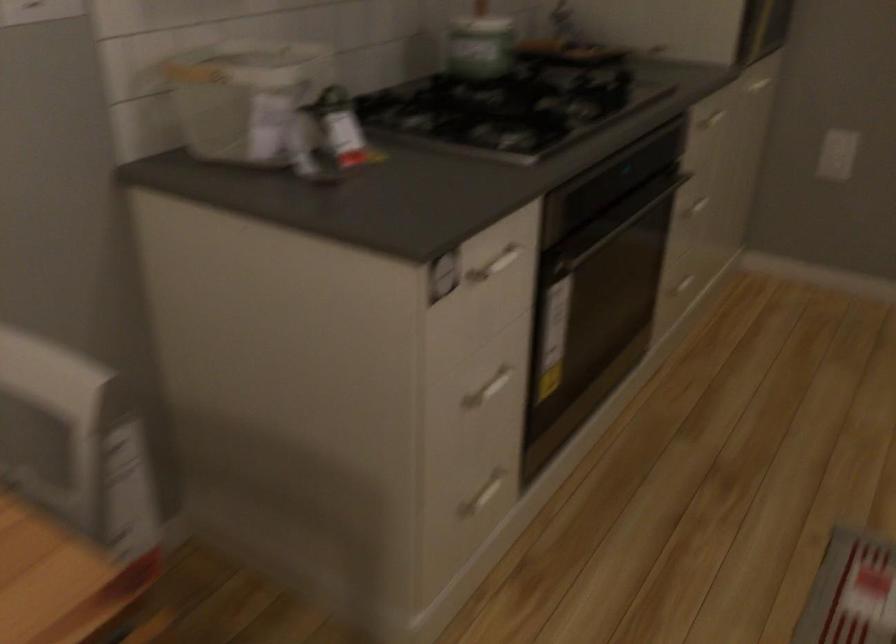
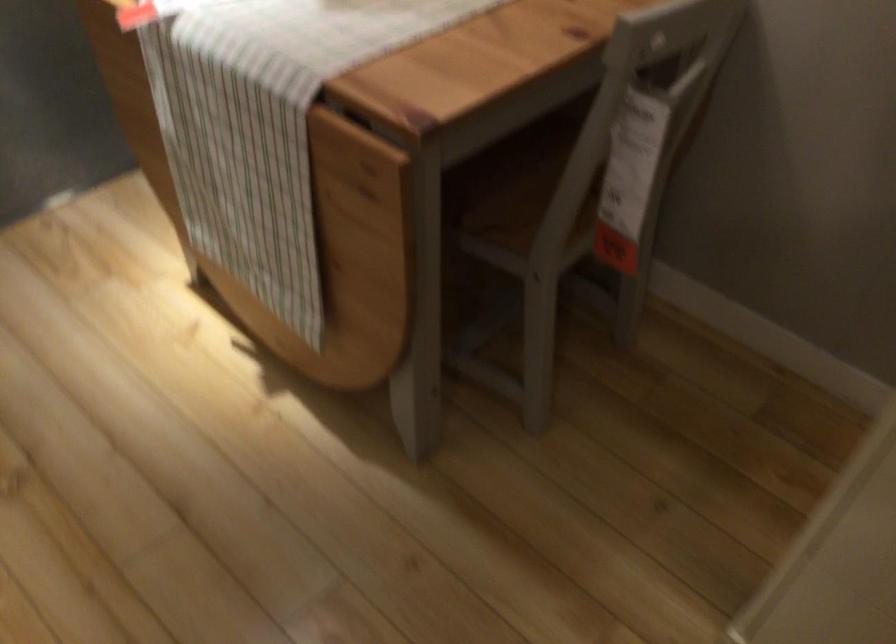
First-person continuous shooting, in which direction is the camera rotating?

The rotation direction of the camera is left-down.